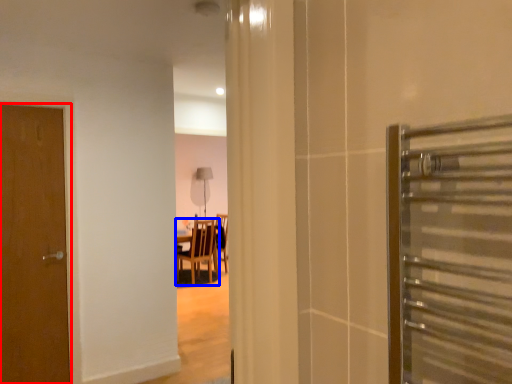
Question: Which point is further to the camera, door (highlighted by a red box) or chair (highlighted by a blue box)?

Choices:
 (A) door
 (B) chair

Answer: (B)